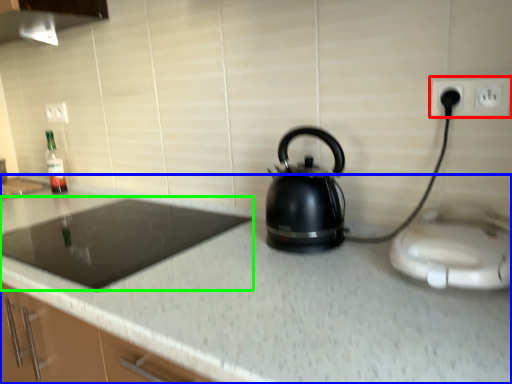
Question: Which object is positioned farthest from electric outlet (highlighted by a red box)? Select from countertop (highlighted by a blue box) and gas stove (highlighted by a green box).

Choices:
 (A) countertop
 (B) gas stove

Answer: (B)